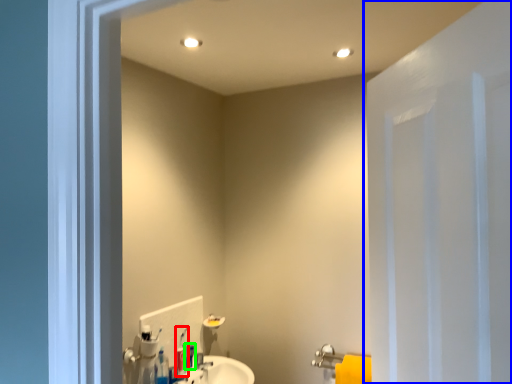
Question: Which object is the closest to the toothbrush (highlighted by a red box)? Choose among these: door (highlighted by a blue box) or toiletry (highlighted by a green box).

Choices:
 (A) door
 (B) toiletry

Answer: (B)